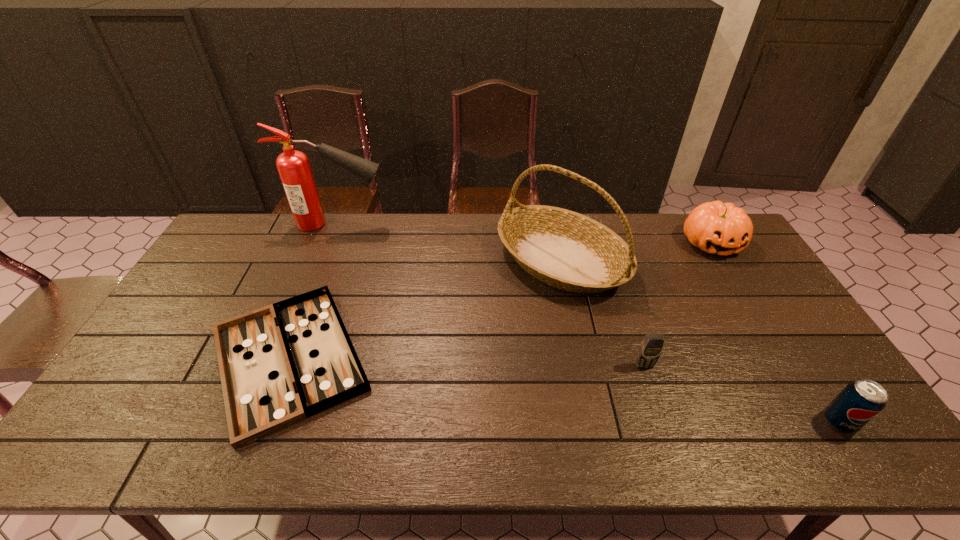
Where is `object at the near right corner`? This screenshot has width=960, height=540. object at the near right corner is located at coordinates (861, 400).

What are the coordinates of `vacant space at the far edge of the desktop` in the screenshot? It's located at (390, 217).

Locate an element on the screen. blank space at the near edge is located at coordinates (451, 454).

In the image, there is a desktop. Where is `free space at the left edge`? The width and height of the screenshot is (960, 540). free space at the left edge is located at coordinates (179, 331).

This screenshot has width=960, height=540. I want to click on vacant position at the right edge of the desktop, so click(x=724, y=279).

Image resolution: width=960 pixels, height=540 pixels. In the image, there is a desktop. Identify the location of free space at the near right corner. [807, 437].

Where is `vacant space in between the shortest object and the soda can`? Image resolution: width=960 pixels, height=540 pixels. vacant space in between the shortest object and the soda can is located at coordinates (x=564, y=390).

The image size is (960, 540). What are the coordinates of `vacant point located between the shortest object and the pumpkin` in the screenshot? It's located at (500, 300).

Image resolution: width=960 pixels, height=540 pixels. I want to click on vacant area between the shortest object and the soda can, so click(564, 390).

Locate an element on the screen. vacant area that lies between the cellular telephone and the fifth shortest object is located at coordinates (603, 313).